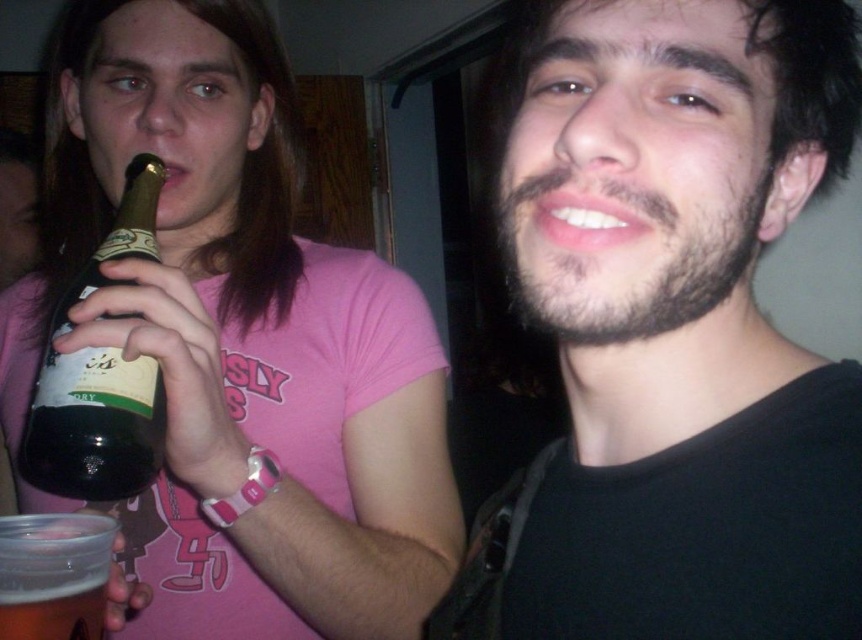
Question: Among these points, which one is nearest to the camera?

Choices:
 (A) (72, 621)
 (B) (784, 544)

Answer: (B)

Question: Does translucent plastic cup at lower left lie in front of clear plastic cup at lower left?

Choices:
 (A) no
 (B) yes

Answer: (B)

Question: Can you confirm if dark brown beard at center is thinner than matte black beer bottle at left?

Choices:
 (A) yes
 (B) no

Answer: (A)

Question: Can you confirm if dark brown beard at center is positioned below clear plastic cup at lower left?

Choices:
 (A) yes
 (B) no

Answer: (B)

Question: Which of these objects is positioned closest to the clear plastic cup at lower left?

Choices:
 (A) translucent plastic cup at lower left
 (B) matte black beer bottle at left

Answer: (A)

Question: Which point appears farthest from the camera in this image?

Choices:
 (A) (88, 323)
 (B) (98, 621)
 (C) (3, 552)

Answer: (A)